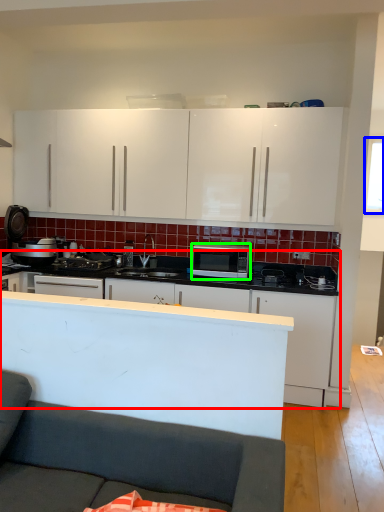
Question: Which object is the closest to the cabinetry (highlighted by a red box)? Choose among these: window screen (highlighted by a blue box) or microwave oven (highlighted by a green box).

Choices:
 (A) window screen
 (B) microwave oven

Answer: (B)